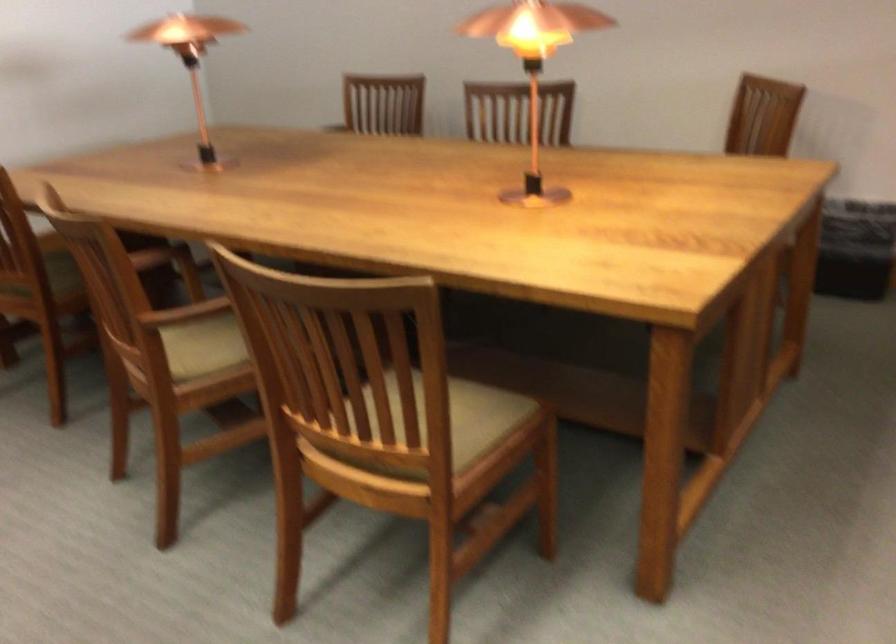
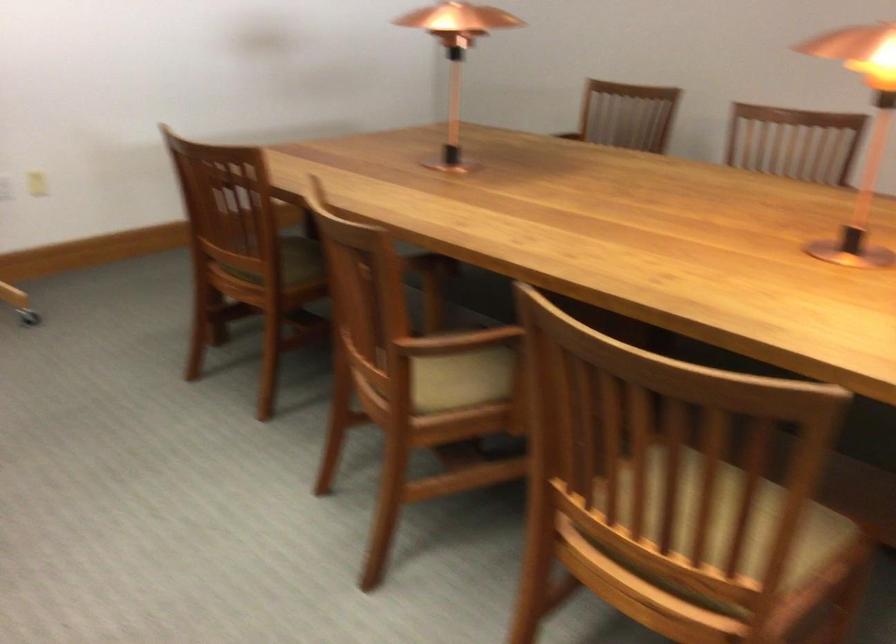
In the second image, find the point that corresponds to pixel 563 99 in the first image.

(860, 131)